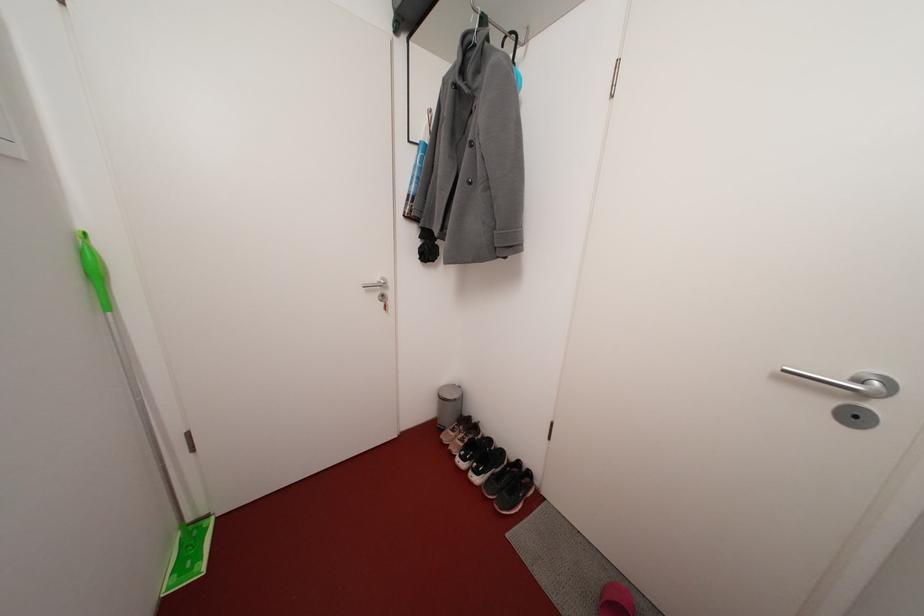
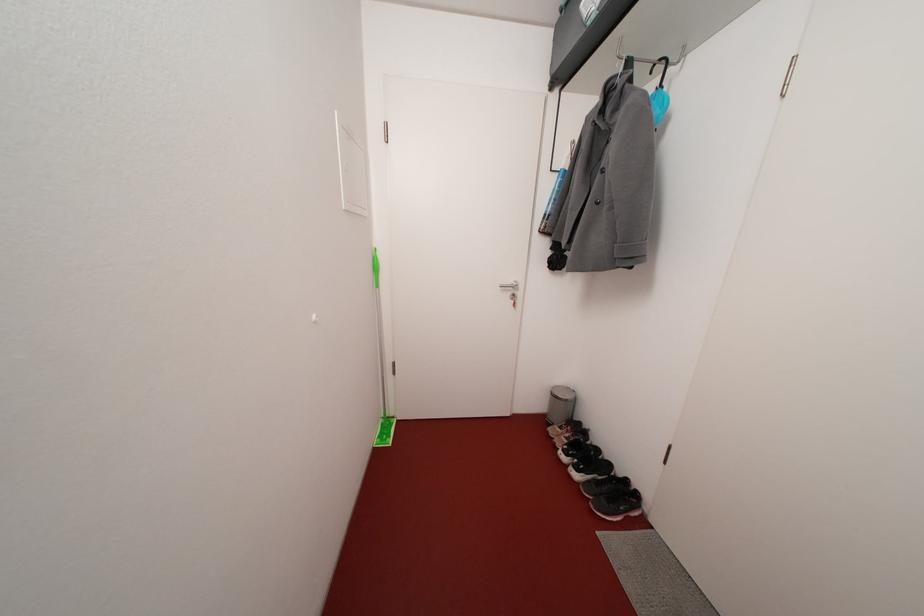
In the second image, find the point that corresponds to the point at 450,442 in the first image.

(556, 435)